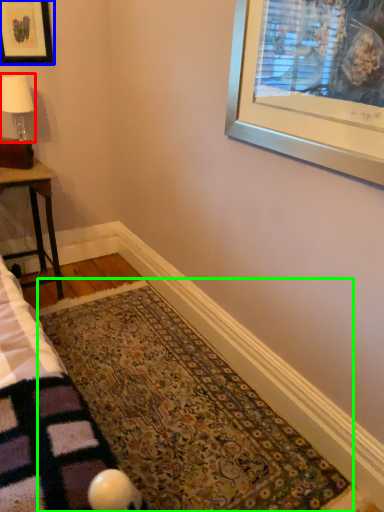
Question: Considering the real-world distances, which object is farthest from lamp (highlighted by a red box)? picture frame (highlighted by a blue box) or mat (highlighted by a green box)?

Choices:
 (A) picture frame
 (B) mat

Answer: (B)